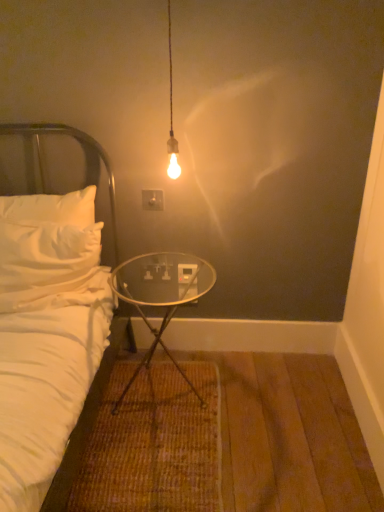
Identify the location of free area below transparent glass table at center (from a real-world perspective). (165, 391).